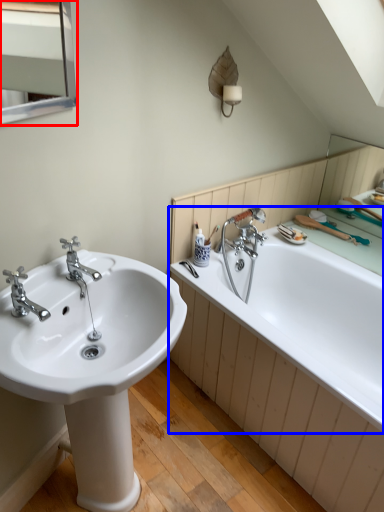
Question: Among these objects, which one is nearest to the camera, medicine cabinet (highlighted by a red box) or bathtub (highlighted by a blue box)?

Choices:
 (A) medicine cabinet
 (B) bathtub

Answer: (A)